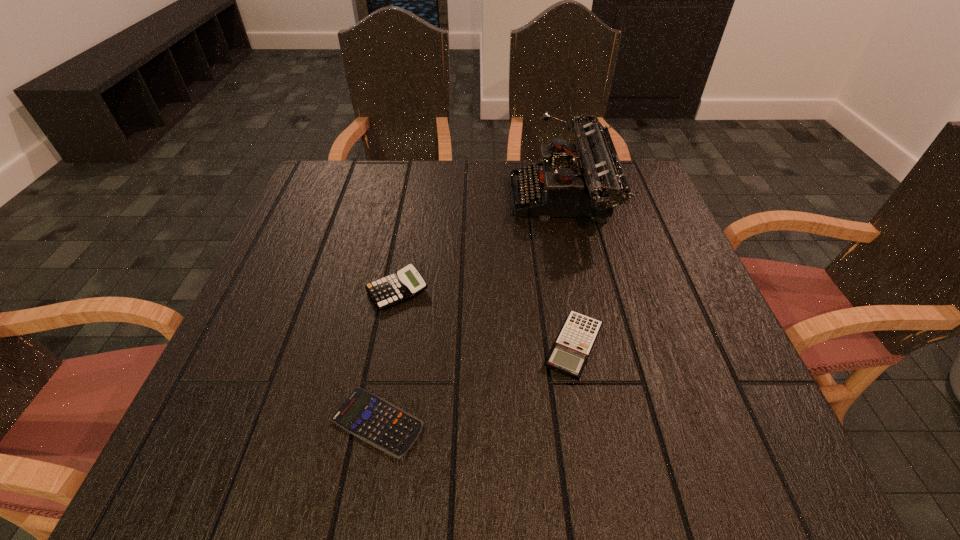
The width and height of the screenshot is (960, 540). In order to click on vacant region between the typewriter and the nearest object in this screenshot , I will do `click(469, 312)`.

Identify the location of unoccupied area between the second tallest calculator and the shortest object. (475, 384).

Identify the location of vacant area between the tallest object and the nearest object. This screenshot has width=960, height=540. (469, 312).

This screenshot has width=960, height=540. Identify the location of vacant space that's between the farthest object and the farthest calculator. (480, 246).

Identify which object is the third closest to the nearest calculator. Please provide its 2D coordinates. Your answer should be formatted as a tuple, i.e. [(x, y)], where the tuple contains the x and y coordinates of a point satisfying the conditions above.

[(590, 182)]

Where is `object that can be found as the second closest to the farthest object`? object that can be found as the second closest to the farthest object is located at coordinates (406, 283).

Choose which calculator is the second nearest neighbor to the third nearest object. Please provide its 2D coordinates. Your answer should be formatted as a tuple, i.e. [(x, y)], where the tuple contains the x and y coordinates of a point satisfying the conditions above.

[(570, 352)]

Identify the location of calculator that is the closest to the third nearest object. This screenshot has height=540, width=960. (374, 420).

This screenshot has height=540, width=960. Find the location of `free region that satisfies the following two spatial constraints: 1. on the back side of the nearest object; 2. on the left side of the third tallest object`. free region that satisfies the following two spatial constraints: 1. on the back side of the nearest object; 2. on the left side of the third tallest object is located at coordinates (391, 346).

Identify the location of vacant region that satisfies the following two spatial constraints: 1. on the back side of the second nearest object; 2. on the right side of the shortest calculator. Image resolution: width=960 pixels, height=540 pixels. click(x=391, y=346).